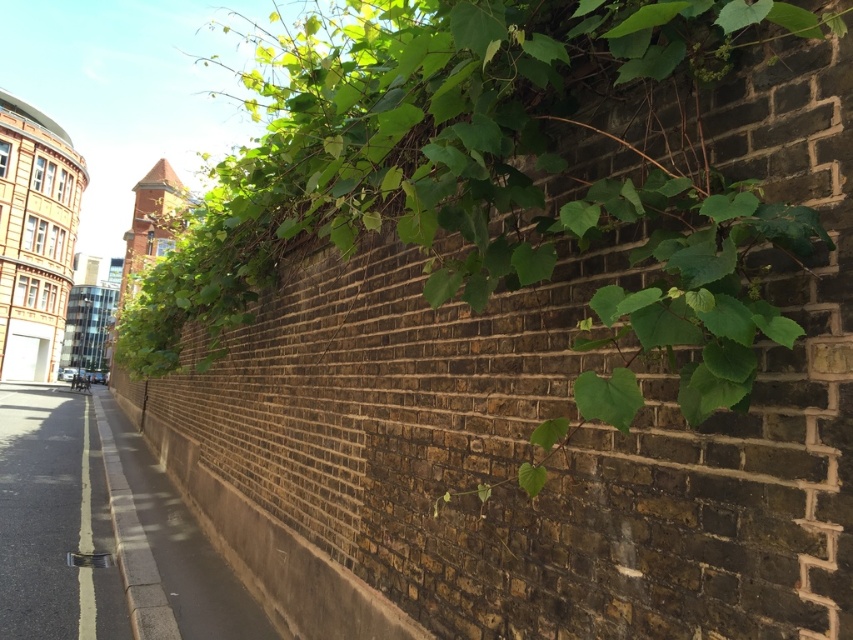
You are standing on the street to the left of the brick wall and want to reach the green leafy plant at upper center. Which direction should you move relative to the wall to get closer to the plant?

The green leafy plant at upper center is located at point (495, 180), so you should move towards the upper center direction relative to the wall to get closer to the plant.

You are a delivery person trying to park your bike. You see the black asphalt at lower left and the gray concrete sidewalk at lower left. Which surface should you choose to park your bike on if you want to avoid the area that is higher?

The black asphalt at lower left is much taller than the gray concrete sidewalk at lower left. Therefore, you should park your bike on the gray concrete sidewalk at lower left to avoid the higher area.

You are standing 30 inches away from the green leafy plant at upper center. Can you comfortably reach out and touch it?

The green leafy plant at upper center is 30.20 inches away from the viewer, so yes, you can comfortably reach out and touch it since it is within arm reach.